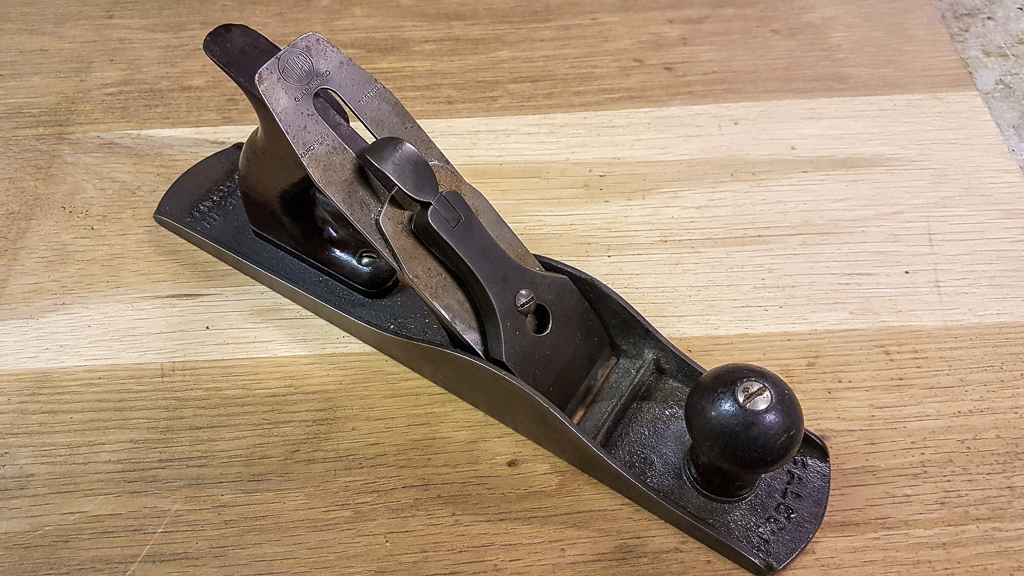
Find the location of a particular element. dark wood grain is located at coordinates (217, 510), (943, 458), (99, 64), (719, 46), (101, 178).